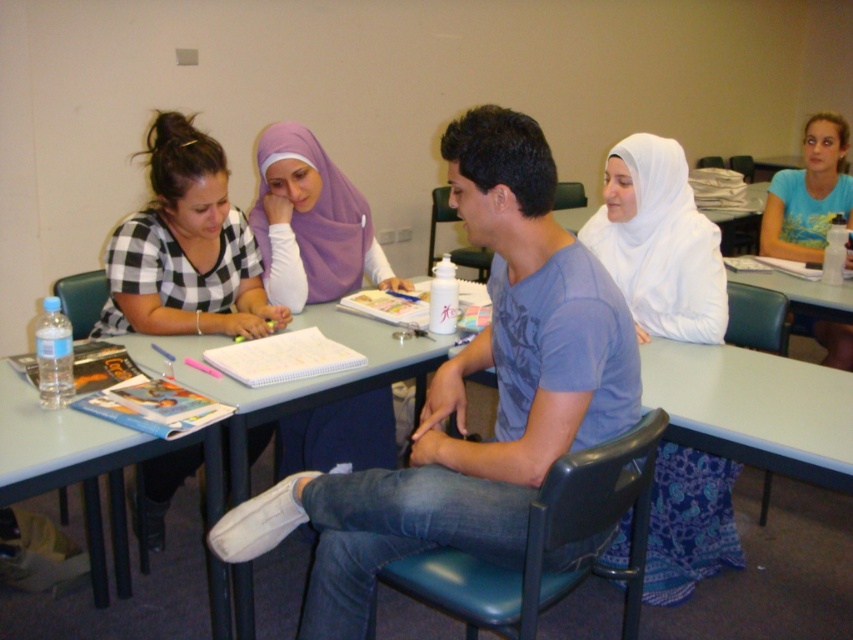
Question: Among these points, which one is farthest from the camera?

Choices:
 (A) (143, 237)
 (B) (91, 458)
 (C) (553, 369)
 (D) (804, 240)

Answer: (D)

Question: Can you confirm if blue cotton shirt at center is bigger than light blue plastic table at center?

Choices:
 (A) yes
 (B) no

Answer: (B)

Question: Is blue cotton shirt at center closer to camera compared to purple fabric hijab at upper center?

Choices:
 (A) yes
 (B) no

Answer: (A)

Question: Which is farther from the white fabric hijab at center?

Choices:
 (A) purple fabric hijab at upper center
 (B) black checkered shirt at upper left

Answer: (B)

Question: Which object is closer to the camera taking this photo?

Choices:
 (A) light blue plastic table at center
 (B) purple fabric hijab at upper center
 (C) blue cotton shirt at center

Answer: (C)

Question: Is white fabric hijab at center to the left of purple fabric hijab at upper center from the viewer's perspective?

Choices:
 (A) yes
 (B) no

Answer: (B)